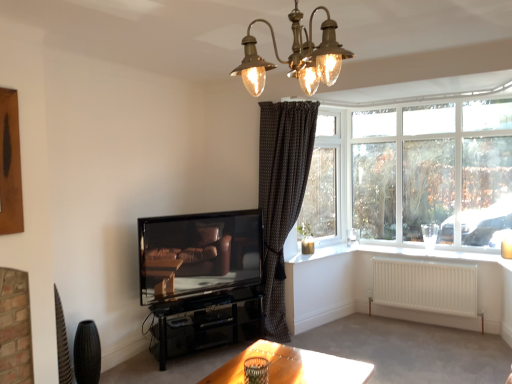
In order to click on vacant area that is in front of white matte radiator at lower right in this screenshot , I will do `click(439, 349)`.